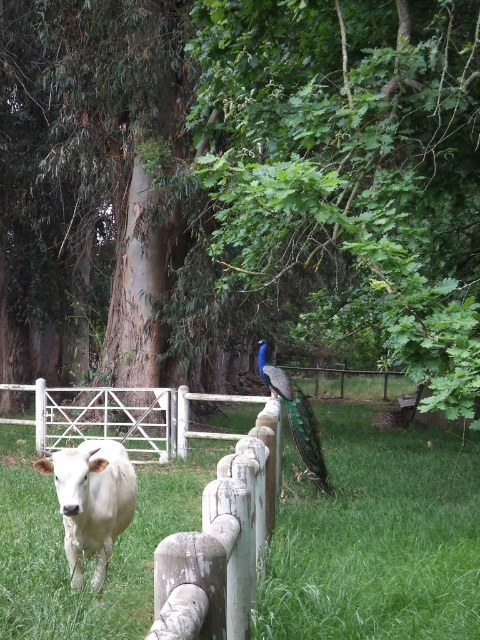
Looking at this image, who is lower down, white glossy bull at center or shiny blue peacock at center?

shiny blue peacock at center

Is point (101, 577) positioned before point (327, 490)?

Yes, point (101, 577) is closer to viewer.

Where is `white glossy bull at center`? This screenshot has width=480, height=640. white glossy bull at center is located at coordinates (92, 500).

Who is shorter, green leafy tree at center or shiny blue peacock at center?

shiny blue peacock at center

Is point (315, 324) farther from viewer compared to point (276, 381)?

That is True.

The height and width of the screenshot is (640, 480). I want to click on green leafy tree at center, so click(244, 180).

This screenshot has width=480, height=640. I want to click on green leafy tree at center, so click(x=244, y=180).

Does green leafy tree at center lie behind white glossy bull at center?

No, it is in front of white glossy bull at center.

Between point (351, 243) and point (78, 490), which one is positioned in front?

Point (351, 243)

The width and height of the screenshot is (480, 640). Find the location of `green leafy tree at center`. green leafy tree at center is located at coordinates (244, 180).